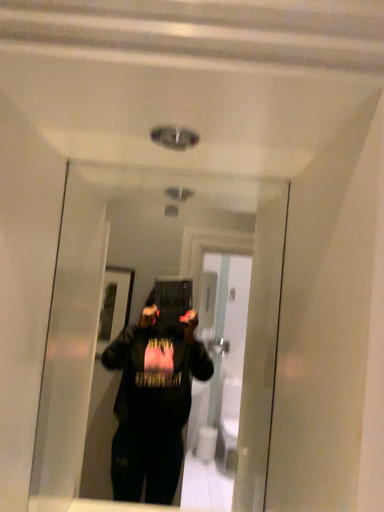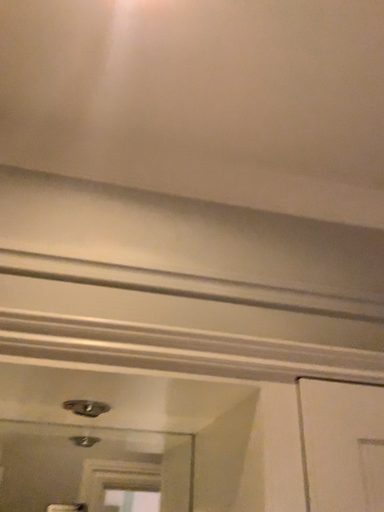
Question: Which way did the camera rotate in the video?

Choices:
 (A) rotated right
 (B) rotated left

Answer: (A)